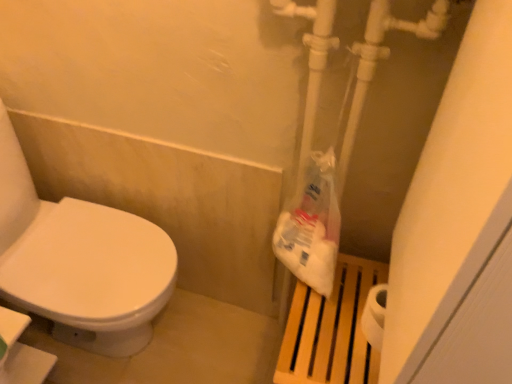
I want to click on empty space that is ontop of wooden slats at right, so click(350, 304).